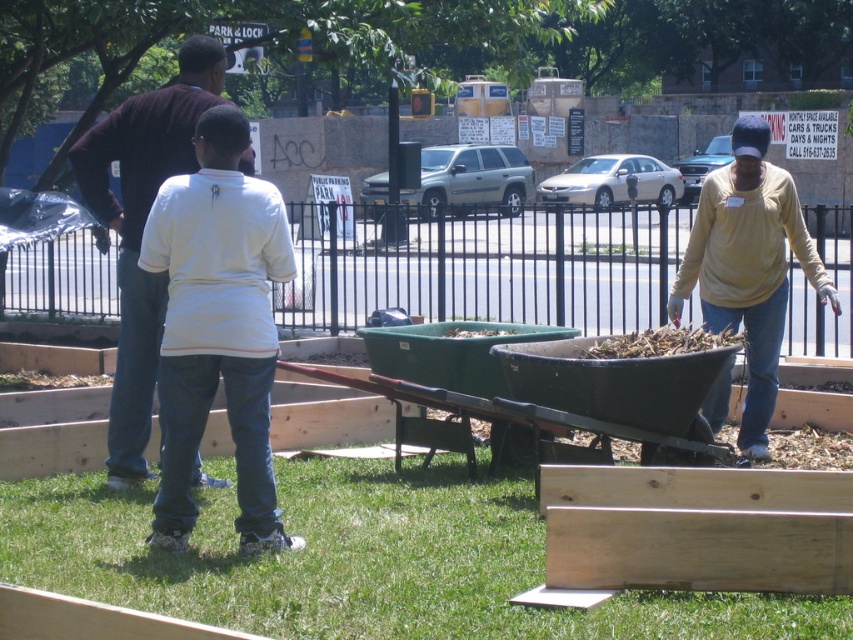
Question: Which point appears closest to the camera in this image?

Choices:
 (A) (155, 296)
 (B) (772, 301)

Answer: (A)

Question: Is dark brown sweater at left above yellow long-sleeved shirt at center?

Choices:
 (A) no
 (B) yes

Answer: (B)

Question: Considering the relative positions of dark brown sweater at left and yellow long-sleeved shirt at center in the image provided, where is dark brown sweater at left located with respect to yellow long-sleeved shirt at center?

Choices:
 (A) above
 (B) below

Answer: (A)

Question: Can you confirm if dark brown sweater at left is positioned below yellow long-sleeved shirt at center?

Choices:
 (A) yes
 (B) no

Answer: (B)

Question: Which point is farther to the camera?

Choices:
 (A) dark brown sweater at left
 (B) yellow long-sleeved shirt at center

Answer: (B)